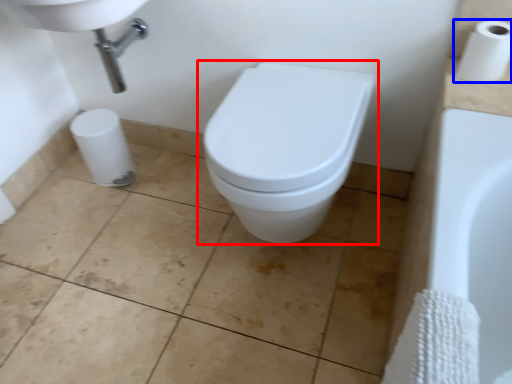
Question: Among these objects, which one is nearest to the camera, toilet (highlighted by a red box) or toilet paper (highlighted by a blue box)?

Choices:
 (A) toilet
 (B) toilet paper

Answer: (A)